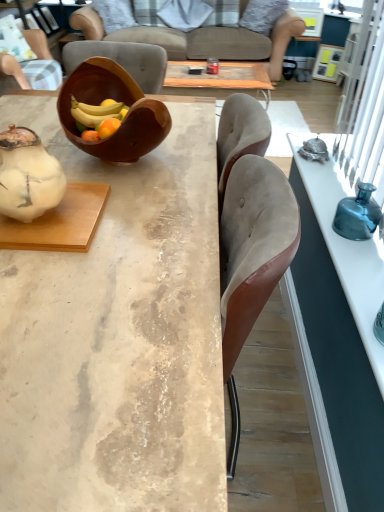
Question: Considering the positions of brown wooden bowl at center and suede chair at upper left in the image, is brown wooden bowl at center bigger or smaller than suede chair at upper left?

Choices:
 (A) big
 (B) small

Answer: (B)

Question: Considering the positions of point (94, 145) and point (48, 49), is point (94, 145) closer or farther from the camera than point (48, 49)?

Choices:
 (A) closer
 (B) farther

Answer: (A)

Question: Which object is the farthest from the white fabric pillow at upper center, positioned as the first pillow in left-to-right order?

Choices:
 (A) matte wood cabinet at upper left
 (B) white matte teapot at left
 (C) blue glass bottle at right
 (D) fluffy gray pillow at upper center, the 1th pillow positioned from the right
 (E) brown wooden bowl at center

Answer: (B)

Question: Estimate the real-world distances between objects in this image. Which object is farther from the brown wooden bowl at center?

Choices:
 (A) suede chair at upper left
 (B) blue glass bottle at right
 (C) teal glass vase at right, acting as the 1th desk starting from the right
 (D) fluffy gray pillow at upper center, which is the 2th pillow in left-to-right order
 (E) marble table at center, which ranks as the first desk in left-to-right order

Answer: (D)